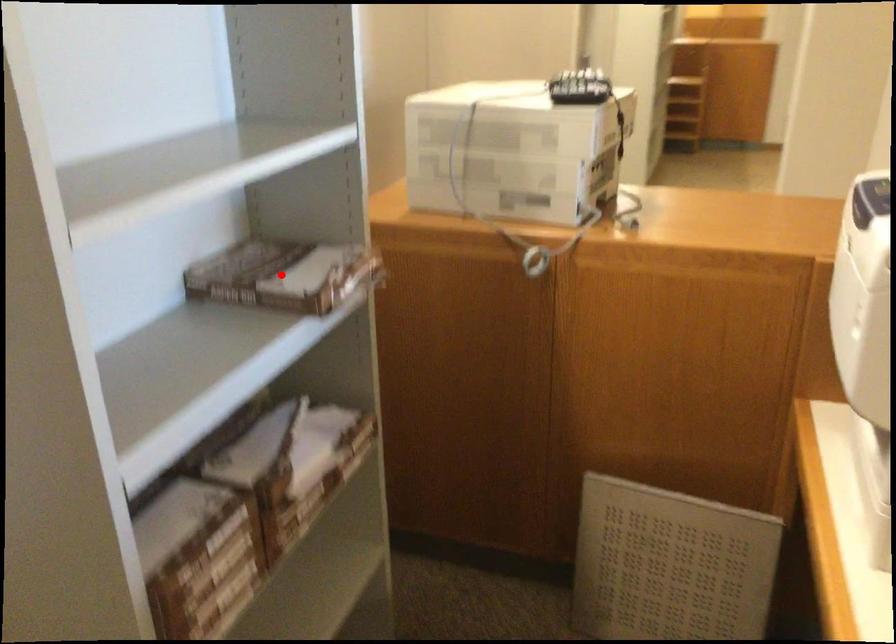
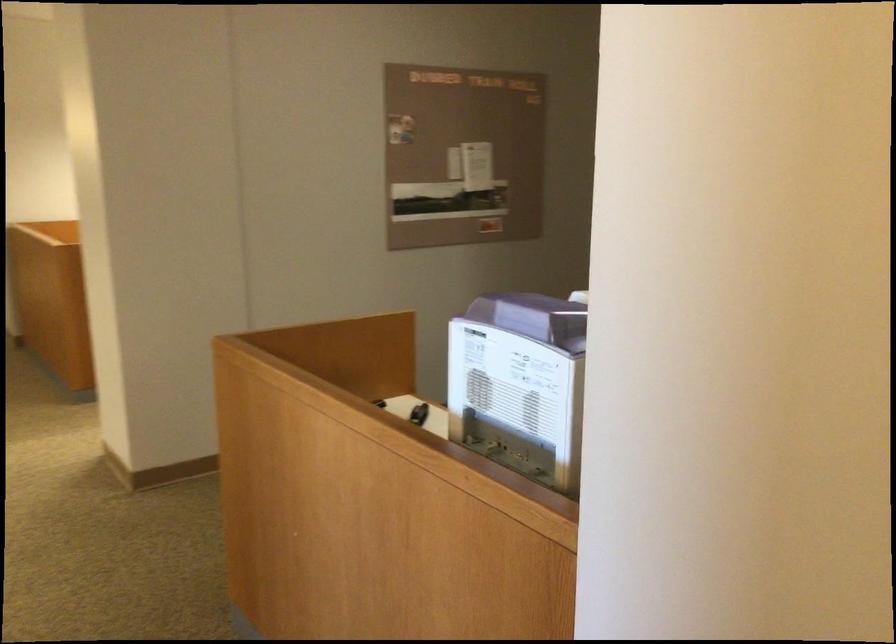
Question: I am providing you with two images of the same scene from different viewpoints. A red point is marked on the first image. Is the red point's position out of view in image 2?

Choices:
 (A) Yes
 (B) No

Answer: (A)